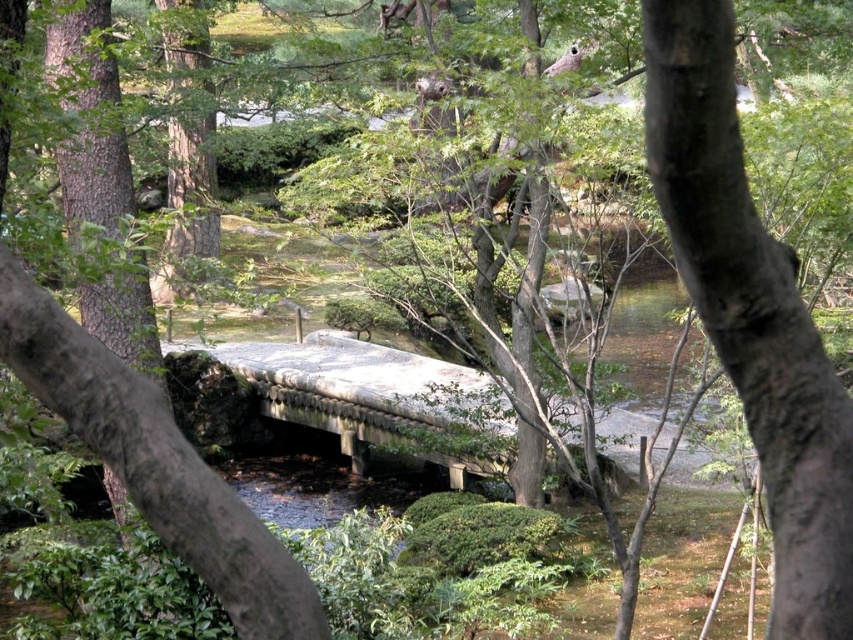
You are a visitor in the garden and want to touch both the smooth brown bark at center and the stone bridge at center. Which object should you approach first if you want to touch the smaller one first?

The smooth brown bark at center has a smaller size compared to the stone bridge at center, so you should approach the smooth brown bark at center first.

Consider the image. You are a painter standing in the Japanese garden and want to sketch the smooth brown bark at center and the stone bridge at center. Which object has a smaller width when viewed from your current position?

The smooth brown bark at center is thinner than the stone bridge at center, so the smooth brown bark at center has a smaller width when viewed from your current position.

You are standing in a Japanese garden and see a point marked at coordinates (751,314). According to the scene description, what is located at that point?

The point at (751,314) marks smooth brown bark at center.